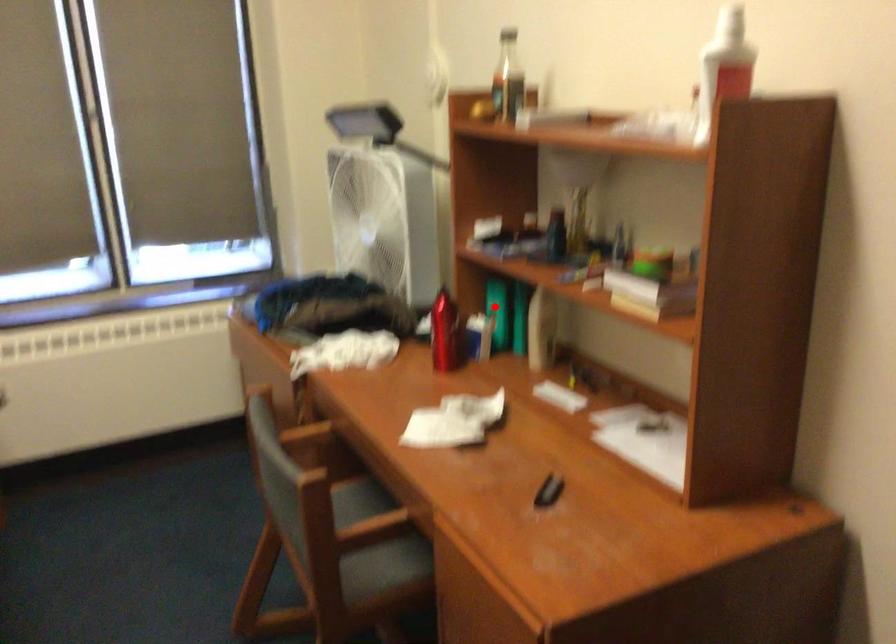
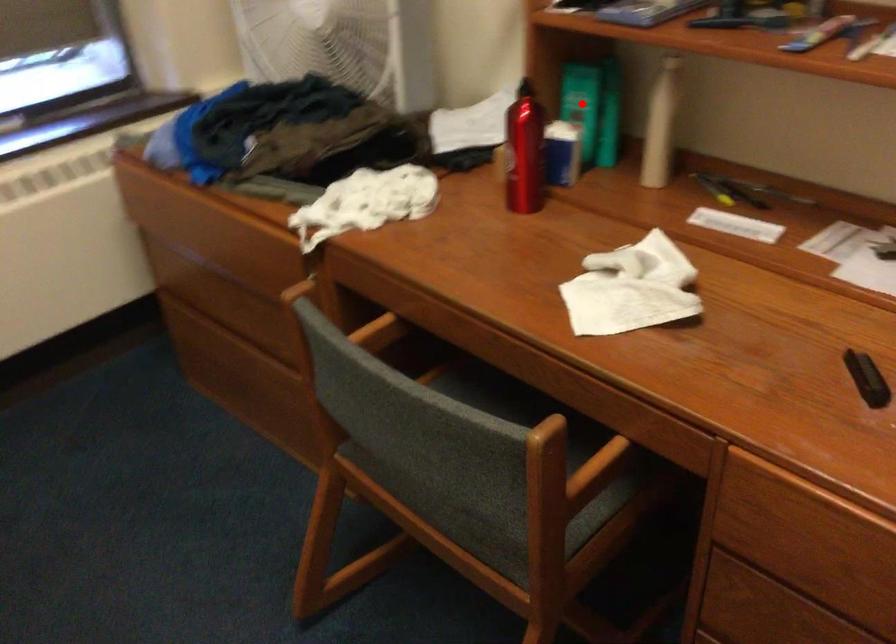
I am providing you with two images of the same scene from different viewpoints. A red point is marked on the first image and another point is marked on the second image. Is the marked point in image1 the same physical position as the marked point in image2?

Yes